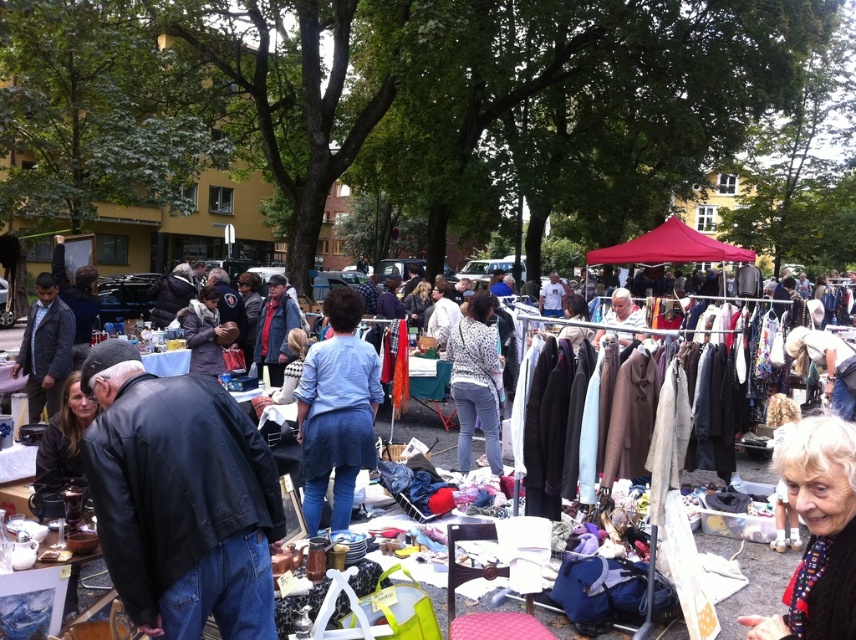
Question: Which point appears farthest from the camera in this image?

Choices:
 (A) (161, 540)
 (B) (480, 593)
 (C) (214, 365)
 (D) (829, 636)

Answer: (C)

Question: Which object is closer to the camera taking this photo?

Choices:
 (A) textured fabric clothing at center
 (B) matte black jacket at lower left
 (C) brown fuzzy coat at center

Answer: (B)

Question: Among these objects, which one is nearest to the camera?

Choices:
 (A) textured fabric clothing at center
 (B) black leather jacket at lower left
 (C) white dotted sweater at center
 (D) matte black jacket at center

Answer: (B)

Question: Does white dotted sweater at center have a smaller size compared to matte black jacket at lower left?

Choices:
 (A) yes
 (B) no

Answer: (B)

Question: Is white woolen sweater at lower right above white dotted sweater at center?

Choices:
 (A) no
 (B) yes

Answer: (A)

Question: Can you confirm if textured fabric clothing at center is bigger than matte black jacket at lower left?

Choices:
 (A) yes
 (B) no

Answer: (B)